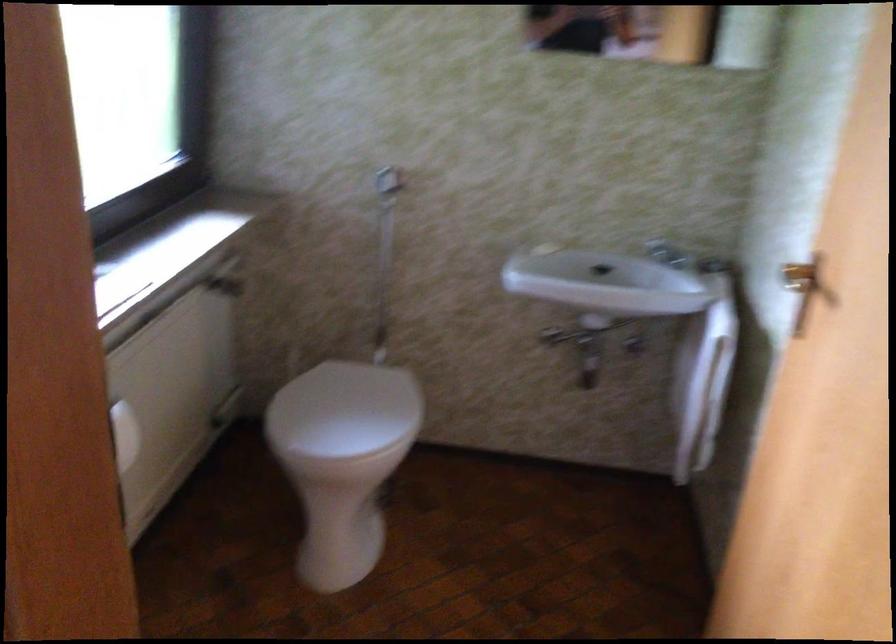
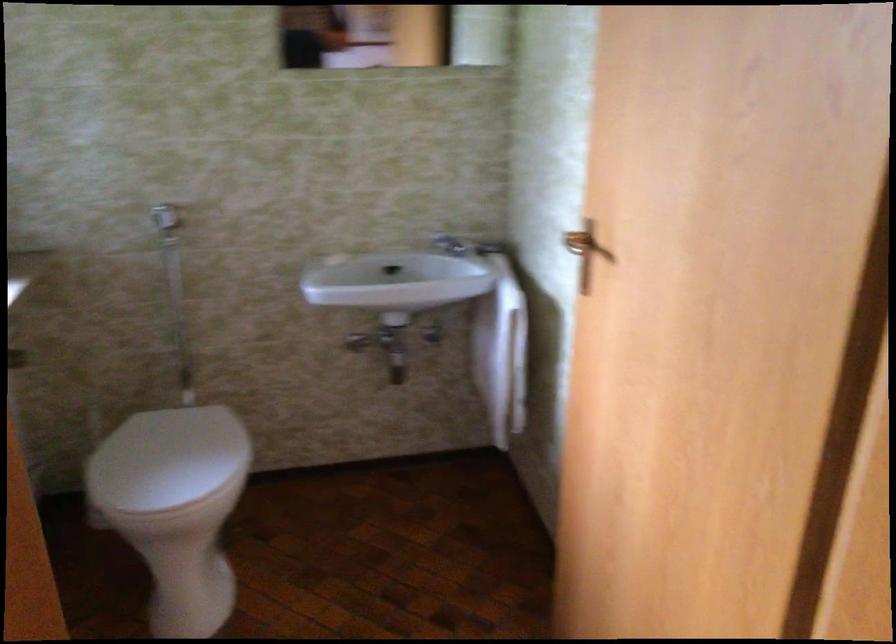
Find the pixel in the second image that matches the point at 670,251 in the first image.

(450, 245)